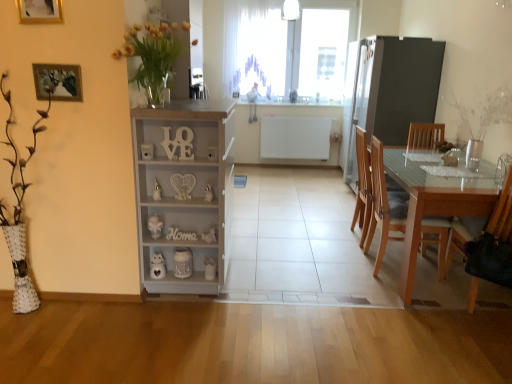
This screenshot has height=384, width=512. What are the coordinates of `clear glass vase at center` in the screenshot? It's located at (158, 93).

What do you see at coordinates (254, 47) in the screenshot? The image size is (512, 384). I see `white sheer curtain at upper center` at bounding box center [254, 47].

In order to face yellow glass vase at upper left, should I rotate leftwards or rightwards?

Rotate your view left by about 12.669°.

Image resolution: width=512 pixels, height=384 pixels. Find the location of `satin silver refrigerator at right, the first appliance from the right`. satin silver refrigerator at right, the first appliance from the right is located at coordinates (393, 90).

Is point (173, 247) more distant than point (306, 130)?

That is False.

Is white painted wood cabinet at center thinner than white matte radiator at center, the 2th appliance positioned from the front?

No.

Can you tell me how much white painted wood cabinet at center and white matte radiator at center, which is the first appliance from back to front, differ in facing direction?

The angular difference between white painted wood cabinet at center and white matte radiator at center, which is the first appliance from back to front, is 90.4 degrees.

How many degrees apart are the facing directions of wooden chair at right, which appears as the third chair when viewed from the back, and white painted wood cabinet at center?

The facing directions of wooden chair at right, which appears as the third chair when viewed from the back, and white painted wood cabinet at center are 87.2 degrees apart.

Is wooden chair at right, which appears as the third chair when viewed from the back, in front of or behind white painted wood cabinet at center in the image?

wooden chair at right, which appears as the third chair when viewed from the back, is positioned closer to the viewer than white painted wood cabinet at center.

Can you confirm if wooden chair at right, which appears as the 1th chair when viewed from the front, is taller than white painted wood cabinet at center?

No.

Does wooden chair at right, which appears as the 1th chair when viewed from the front, appear on the right side of white painted wood cabinet at center?

Yes.

Is white sheer curtain at upper center to the right of light brown wood chair at right, the second chair viewed from the back, from the viewer's perspective?

No.

You are a GUI agent. You are given a task and a screenshot of the screen. Output one action in this format:
    pyautogui.click(x=<x>, y=<y>)
    Task: Click on the 2nd chair positioned below the white sheer curtain at upper center (from the image's perspective)
    This screenshot has height=384, width=512.
    Given the screenshot: What is the action you would take?
    pyautogui.click(x=385, y=204)

Can you see white sheer curtain at upper center touching light brown wood chair at right, acting as the 2th chair starting from the front?

No, white sheer curtain at upper center is not in contact with light brown wood chair at right, acting as the 2th chair starting from the front.

From a real-world perspective, between white sheer curtain at upper center and light brown wood chair at right, acting as the 2th chair starting from the front, who is vertically lower?

In real-world perspective, light brown wood chair at right, acting as the 2th chair starting from the front, is lower.

How different are the orientations of wooden chair at right, which appears as the 1th chair when viewed from the front, and white matte radiator at center, the 2th appliance in the right-to-left sequence, in degrees?

The angle between the facing direction of wooden chair at right, which appears as the 1th chair when viewed from the front, and the facing direction of white matte radiator at center, the 2th appliance in the right-to-left sequence, is 178 degrees.

This screenshot has width=512, height=384. What are the coordinates of `the 1st appliance above when counting from the wooden chair at right, which appears as the 1th chair when viewed from the front (from the image's perspective)` in the screenshot? It's located at (295, 137).

Considering the positions of objects wooden chair at right, which appears as the third chair when viewed from the back, and white matte radiator at center, the 2th appliance positioned from the front, in the image provided, who is more to the right, wooden chair at right, which appears as the third chair when viewed from the back, or white matte radiator at center, the 2th appliance positioned from the front,?

wooden chair at right, which appears as the third chair when viewed from the back, is more to the right.

From the picture: Can you confirm if wooden chair at right, which appears as the third chair when viewed from the back, is wider than white matte radiator at center, the 2th appliance positioned from the front?

Yes.

Do you think transparent glass table at right is within clear glass vase at center, or outside of it?

transparent glass table at right is spatially situated outside clear glass vase at center.

From a real-world perspective, is transparent glass table at right under clear glass vase at center?

Indeed, from a real-world perspective, transparent glass table at right is positioned beneath clear glass vase at center.

Can you confirm if transparent glass table at right is thinner than clear glass vase at center?

No.

Looking at this image, could you tell me if transparent glass table at right is turned towards clear glass vase at center?

No, transparent glass table at right is not turned towards clear glass vase at center.

Between light brown wood chair at right, acting as the 2th chair starting from the front, and gold wooden picture frame at upper left, which appears as the 2th picture frame when viewed from the back, which one appears on the left side from the viewer's perspective?

gold wooden picture frame at upper left, which appears as the 2th picture frame when viewed from the back.

Can you tell me how much light brown wood chair at right, the second chair viewed from the back, and gold wooden picture frame at upper left, which is the 2th picture frame from bottom to top, differ in facing direction?

89.5 degrees separate the facing orientations of light brown wood chair at right, the second chair viewed from the back, and gold wooden picture frame at upper left, which is the 2th picture frame from bottom to top.

Is light brown wood chair at right, acting as the 2th chair starting from the front, smaller than gold wooden picture frame at upper left, acting as the 1th picture frame starting from the top?

Incorrect, light brown wood chair at right, acting as the 2th chair starting from the front, is not smaller in size than gold wooden picture frame at upper left, acting as the 1th picture frame starting from the top.

Does point (381, 177) lie behind point (50, 1)?

Yes.

Image resolution: width=512 pixels, height=384 pixels. In order to click on picture frame that is the 2nd object located above the light brown wood chair at right, placed as the third chair when sorted from front to back (from the image's perspective) in this screenshot , I will do `click(40, 11)`.

Could you tell me if light brown wood chair at right, acting as the 1th chair starting from the back, is facing gold wooden picture frame at upper left, which is the 2th picture frame from bottom to top?

No, light brown wood chair at right, acting as the 1th chair starting from the back, does not turn towards gold wooden picture frame at upper left, which is the 2th picture frame from bottom to top.

Between light brown wood chair at right, acting as the 1th chair starting from the back, and gold wooden picture frame at upper left, acting as the 1th picture frame starting from the top, which one has more height?

light brown wood chair at right, acting as the 1th chair starting from the back, is taller.

Starting from the white painted wood cabinet at center, which appliance is the 2nd one behind? Please provide its 2D coordinates.

[(295, 137)]

Where is `cabinetry on the left of wooden chair at right, which appears as the third chair when viewed from the back`? cabinetry on the left of wooden chair at right, which appears as the third chair when viewed from the back is located at coordinates (185, 190).

Based on their spatial positions, is yellow glass vase at upper left or white matte radiator at center, acting as the 1th appliance starting from the left, closer to clear glass vase at center?

Based on the image, yellow glass vase at upper left appears to be nearer to clear glass vase at center.

Estimate the real-world distances between objects in this image. Which object is closer to white sheer curtain at upper center, light brown wood chair at right, placed as the third chair when sorted from front to back, or transparent glass window at upper center?

transparent glass window at upper center is closer to white sheer curtain at upper center.

In the scene shown: Considering their positions, is light brown wood chair at right, placed as the third chair when sorted from front to back, positioned further to white matte radiator at center, the 2th appliance positioned from the front, than clear glass vase at center?

clear glass vase at center.

Estimate the real-world distances between objects in this image. Which object is closer to white matte radiator at center, which is the first appliance from back to front, clear glass vase at center or wooden chair at right, which appears as the 1th chair when viewed from the front?

wooden chair at right, which appears as the 1th chair when viewed from the front.

Estimate the real-world distances between objects in this image. Which object is closer to light brown wood chair at right, acting as the 2th chair starting from the front, white matte radiator at center, the 2th appliance positioned from the front, or wooden chair at right, which appears as the 1th chair when viewed from the front?

Based on the image, wooden chair at right, which appears as the 1th chair when viewed from the front, appears to be nearer to light brown wood chair at right, acting as the 2th chair starting from the front.

When comparing their distances from clear glass vase at center, does transparent glass window at upper center or light brown wood chair at right, acting as the 2th chair starting from the front, seem closer?

The object closer to clear glass vase at center is light brown wood chair at right, acting as the 2th chair starting from the front.

Estimate the real-world distances between objects in this image. Which object is closer to transparent glass table at right, transparent glass window at upper center or yellow glass vase at upper left?

The object closer to transparent glass table at right is yellow glass vase at upper left.

Based on their spatial positions, is white sheer curtain at upper center or light brown wood chair at right, placed as the third chair when sorted from front to back, closer to wooden chair at right, which appears as the 1th chair when viewed from the front?

Among the two, light brown wood chair at right, placed as the third chair when sorted from front to back, is located nearer to wooden chair at right, which appears as the 1th chair when viewed from the front.

The height and width of the screenshot is (384, 512). Identify the location of picture frame that lies between clear glass vase at center and white painted wood cabinet at center from top to bottom. (58, 82).

Where is `window located between light brown wood chair at right, placed as the third chair when sorted from front to back, and white matte radiator at center, which is the first appliance from back to front, in the depth direction`? This screenshot has height=384, width=512. window located between light brown wood chair at right, placed as the third chair when sorted from front to back, and white matte radiator at center, which is the first appliance from back to front, in the depth direction is located at coordinates (284, 45).

Locate an element on the screen. window located between yellow glass vase at upper left and white matte radiator at center, the 2th appliance positioned from the front, in the depth direction is located at coordinates (284, 45).

Locate an element on the screen. This screenshot has height=384, width=512. glass vase between wooden picture frame at upper left, the second picture frame viewed from the front, and white sheer curtain at upper center from front to back is located at coordinates (158, 93).